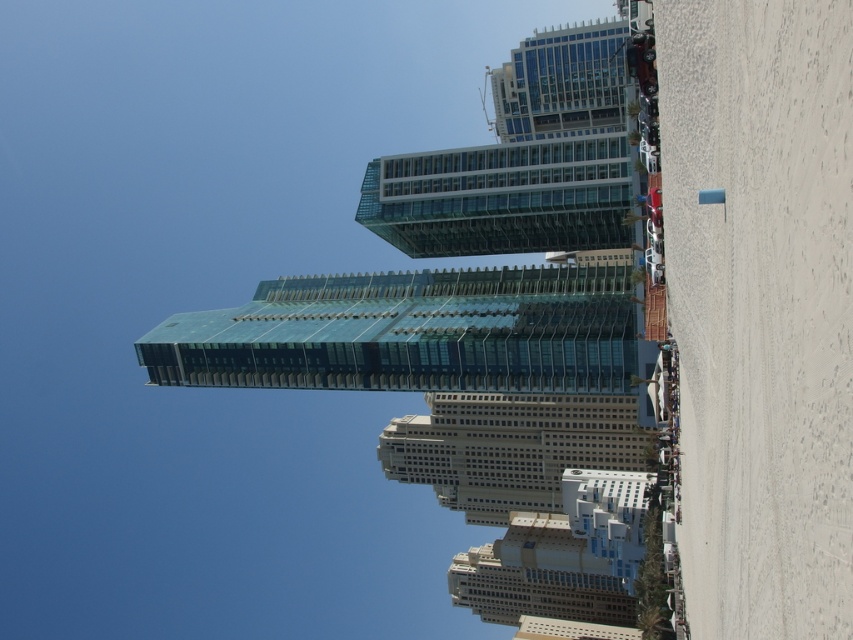
Question: Can you confirm if transparent glass tower at center is thinner than beige stone building at center?

Choices:
 (A) yes
 (B) no

Answer: (B)

Question: Is transparent glass tower at center bigger than beige stone building at center?

Choices:
 (A) no
 (B) yes

Answer: (A)

Question: Does transparent glass tower at center have a greater width compared to beige stone building at center?

Choices:
 (A) yes
 (B) no

Answer: (A)

Question: Which of the following is the farthest from the observer?

Choices:
 (A) transparent glass tower at center
 (B) beige stone building at center

Answer: (B)